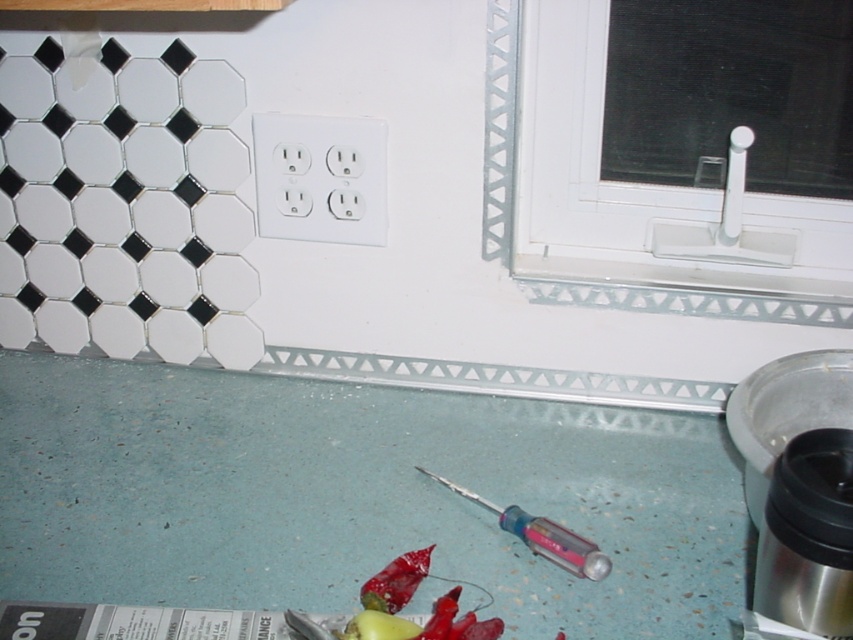
Locate an element on the screen. blue speckled countertop at lower center is located at coordinates (357, 497).

Does point (628, 428) come farther from viewer compared to point (836, 428)?

Yes, it is behind point (836, 428).

Locate an element on the screen. blue speckled countertop at lower center is located at coordinates (357, 497).

Which of these two, white plastic window sill at right or stainless steel blender at lower right, stands shorter?

stainless steel blender at lower right

Is point (576, 243) positioned before point (772, 461)?

No.

You are a GUI agent. You are given a task and a screenshot of the screen. Output one action in this format:
    pyautogui.click(x=<x>, y=<y>)
    Task: Click on the white plastic window sill at right
    
    Given the screenshot: What is the action you would take?
    pyautogui.click(x=657, y=180)

Can you confirm if blue speckled countertop at lower center is wider than pink plastic screwdriver at lower center?

Yes.

Is blue speckled countertop at lower center to the right of pink plastic screwdriver at lower center from the viewer's perspective?

In fact, blue speckled countertop at lower center is to the left of pink plastic screwdriver at lower center.

Between point (614, 435) and point (514, 515), which one is positioned in front?

Point (514, 515) is in front.

Image resolution: width=853 pixels, height=640 pixels. Find the location of `blue speckled countertop at lower center`. blue speckled countertop at lower center is located at coordinates (357, 497).